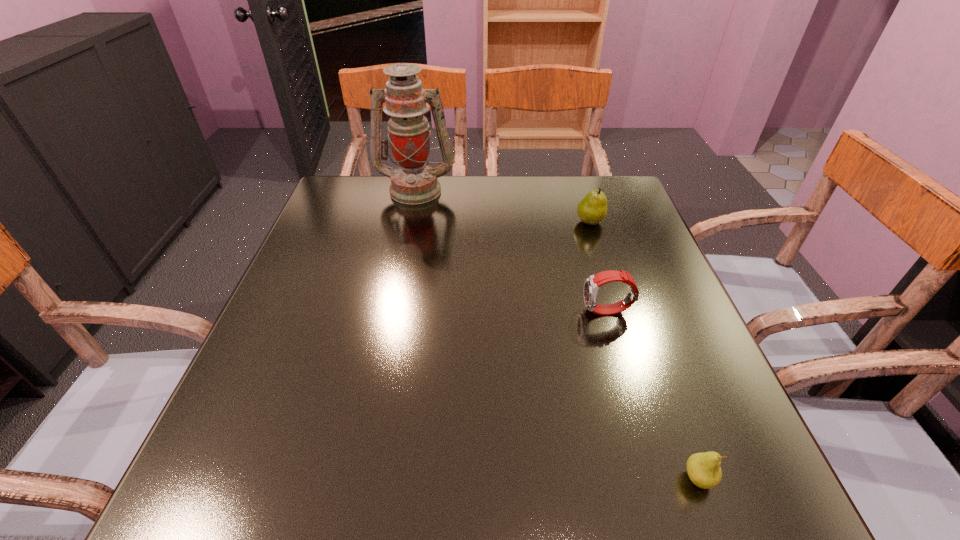
Identify the location of vacant space situated on the left of the nearer pear. (614, 478).

Where is `oil lamp at the far edge`? Image resolution: width=960 pixels, height=540 pixels. oil lamp at the far edge is located at coordinates (414, 182).

Locate an element on the screen. pear at the far edge is located at coordinates (592, 209).

Where is `object present at the near edge`? Image resolution: width=960 pixels, height=540 pixels. object present at the near edge is located at coordinates (703, 469).

This screenshot has width=960, height=540. I want to click on object located at the left edge, so click(414, 182).

I want to click on watch positioned at the right edge, so click(x=592, y=284).

Where is `object positioned at the far left corner`? The height and width of the screenshot is (540, 960). object positioned at the far left corner is located at coordinates (414, 182).

The width and height of the screenshot is (960, 540). I want to click on object situated at the far right corner, so click(592, 209).

Locate an element on the screen. object at the near right corner is located at coordinates (703, 469).

I want to click on vacant region at the far edge of the desktop, so click(440, 180).